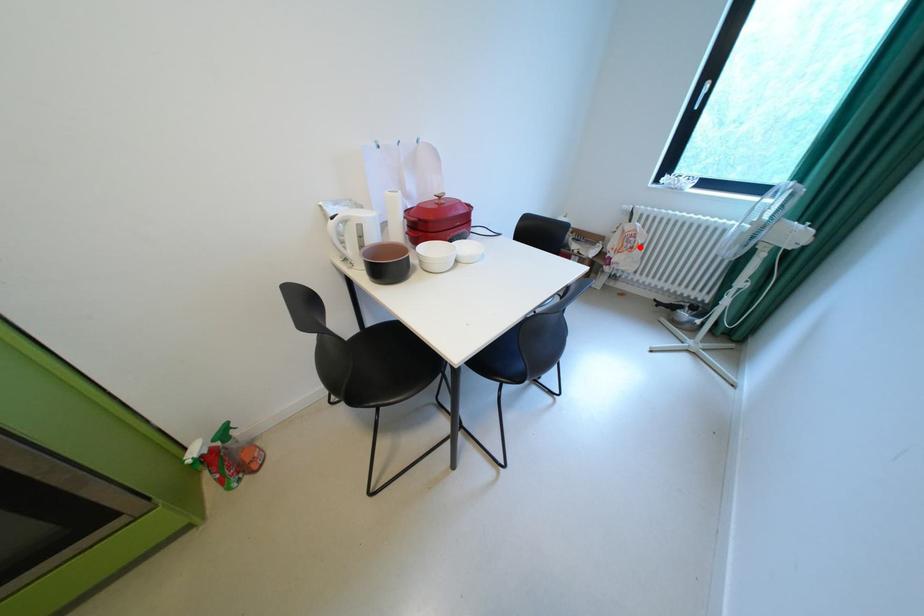
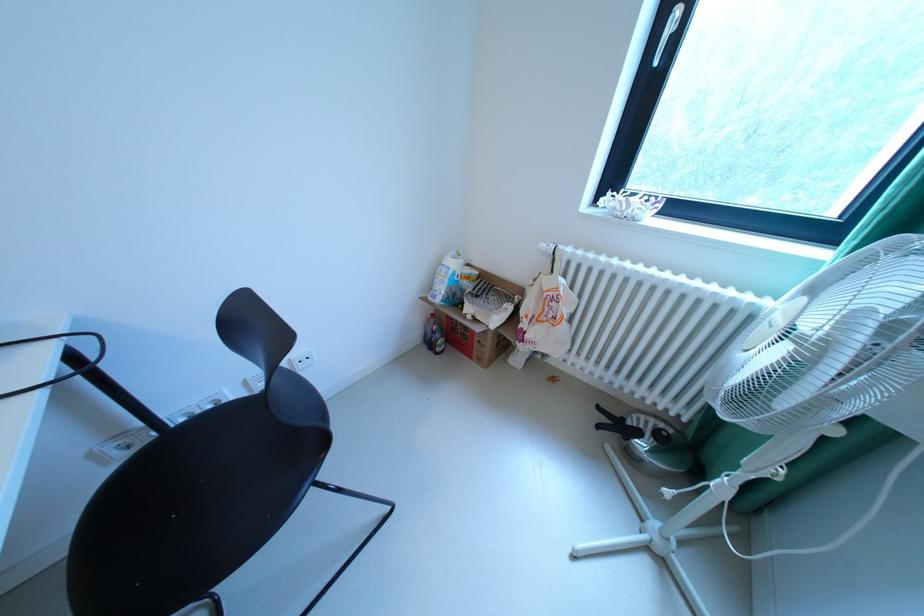
Where in the second image is the point corresponding to the highlighted location from the first image?

(561, 317)